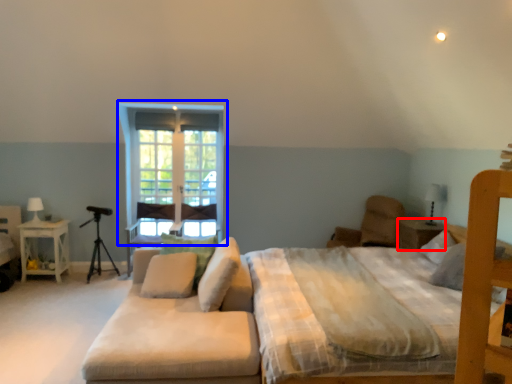
Question: Which object is further to the camera taking this photo, nightstand (highlighted by a red box) or window (highlighted by a blue box)?

Choices:
 (A) nightstand
 (B) window

Answer: (B)